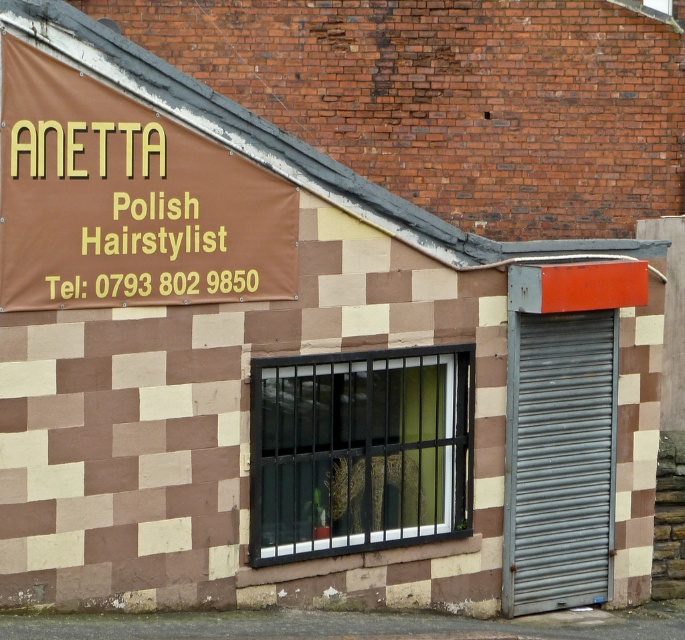
Question: Which point is closer to the camera taking this photo?

Choices:
 (A) (316, 497)
 (B) (238, 212)

Answer: (B)

Question: Does black metal window at center appear under gray metallic shutter at right?

Choices:
 (A) yes
 (B) no

Answer: (B)

Question: Which object is farther from the camera taking this photo?

Choices:
 (A) black metal window at center
 (B) brown vinyl banner at upper left
 (C) gray metallic shutter at right

Answer: (C)

Question: Is black metal window at center bigger than gray metallic shutter at right?

Choices:
 (A) no
 (B) yes

Answer: (B)

Question: Which point appears farthest from the camera in this image?

Choices:
 (A) (525, 588)
 (B) (206, 256)

Answer: (A)

Question: Does black metal window at center appear on the right side of gray metallic shutter at right?

Choices:
 (A) no
 (B) yes

Answer: (A)